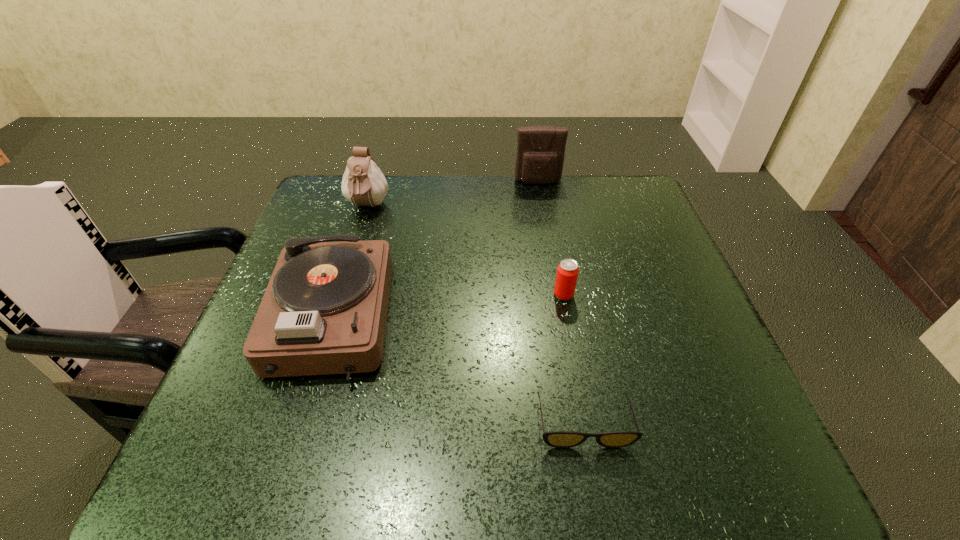
Locate an element on the screen. The image size is (960, 540). vacant area located on the back of the record player is located at coordinates [367, 206].

Where is `vacant space located 0.210m on the left of the fourth tallest object`? The height and width of the screenshot is (540, 960). vacant space located 0.210m on the left of the fourth tallest object is located at coordinates (457, 295).

Find the location of a particular element. Image resolution: width=960 pixels, height=540 pixels. object that is at the near edge is located at coordinates (559, 439).

Locate an element on the screen. The image size is (960, 540). pouch that is positioned at the left edge is located at coordinates (x=363, y=184).

Image resolution: width=960 pixels, height=540 pixels. I want to click on record player situated at the left edge, so click(x=324, y=311).

This screenshot has width=960, height=540. In order to click on object that is at the far left corner in this screenshot , I will do `click(363, 184)`.

What are the coordinates of `vacant region at the far edge of the desktop` in the screenshot? It's located at (561, 221).

At what (x,y) coordinates should I click in order to perform the action: click on free space at the left edge. Please return your answer as a coordinate pair (x, y). The image size is (960, 540). Looking at the image, I should click on (268, 394).

In the image, there is a desktop. Identify the location of vacant space at the right edge. (663, 312).

This screenshot has width=960, height=540. I want to click on vacant region at the far left corner, so click(338, 192).